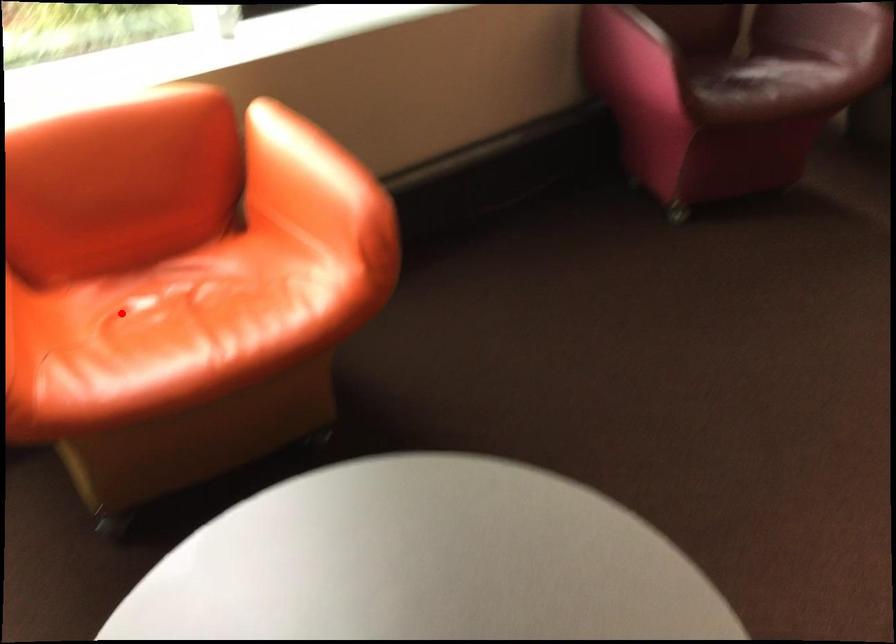
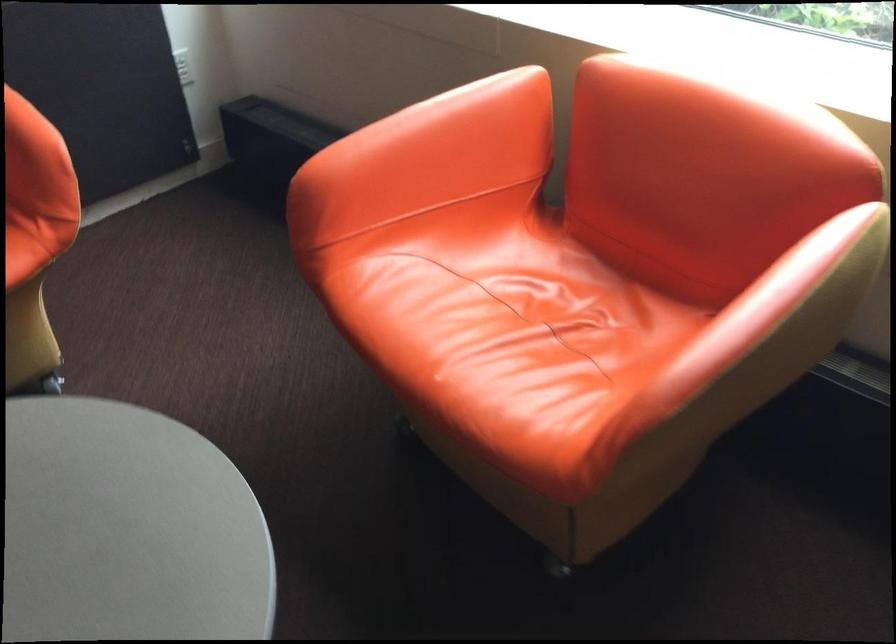
Where in the second image is the point corresponding to the highlighted location from the first image?

(519, 277)